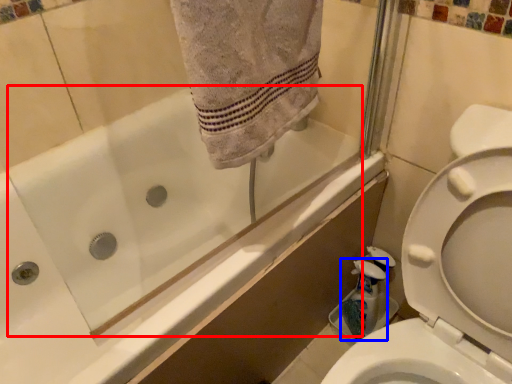
Question: Among these objects, which one is farthest to the camera, bath (highlighted by a red box) or cleaning product (highlighted by a blue box)?

Choices:
 (A) bath
 (B) cleaning product

Answer: (B)